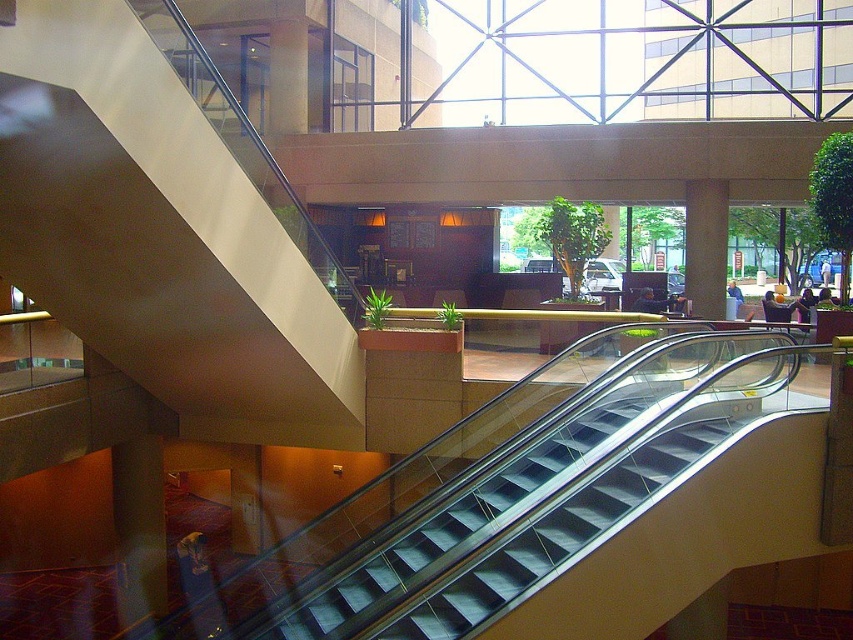
Looking at this image, you are standing in the atrium and want to reach the reception desk on the second level. There are two points marked on the floor plan. One is at point (379, 600) and the other at point (705, 305). Which point should you stand on to get a better view of the reception desk?

Point (379, 600) is closer to the viewer than point (705, 305), so standing on point (379, 600) would provide a better view of the reception desk.

You are standing at the entrance of the modern building and want to reach the reception desk located on the second level. The metallic silver escalator at center is your only option. Can you use it to reach the desk?

Yes, the metallic silver escalator at center leads up to the second level where the reception desk is located, so you can use it to reach the desk.